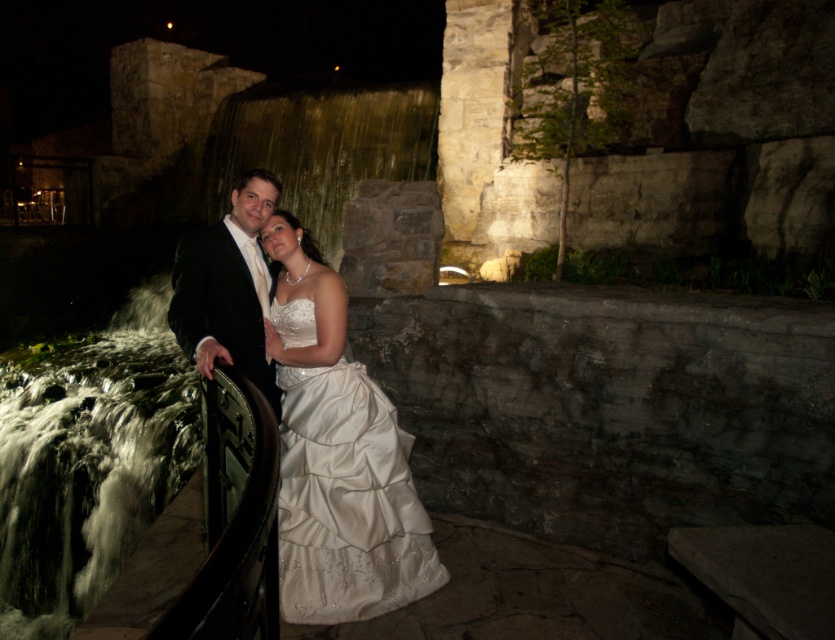
Consider the image. You are a photographer at the wedding. You want to capture a closeup shot of the couple while ensuring both the satin white dress at center and the shiny black suit at center are visible. Given their sizes, which part of the couple should you focus on to include both in the frame?

The satin white dress at center is bigger than the shiny black suit at center, so focusing on the center where both are positioned will ensure both are visible in the frame.